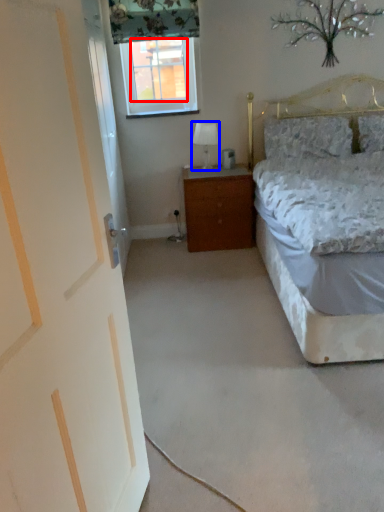
Question: Which object is closer to the camera taking this photo, window screen (highlighted by a red box) or table lamp (highlighted by a blue box)?

Choices:
 (A) window screen
 (B) table lamp

Answer: (B)